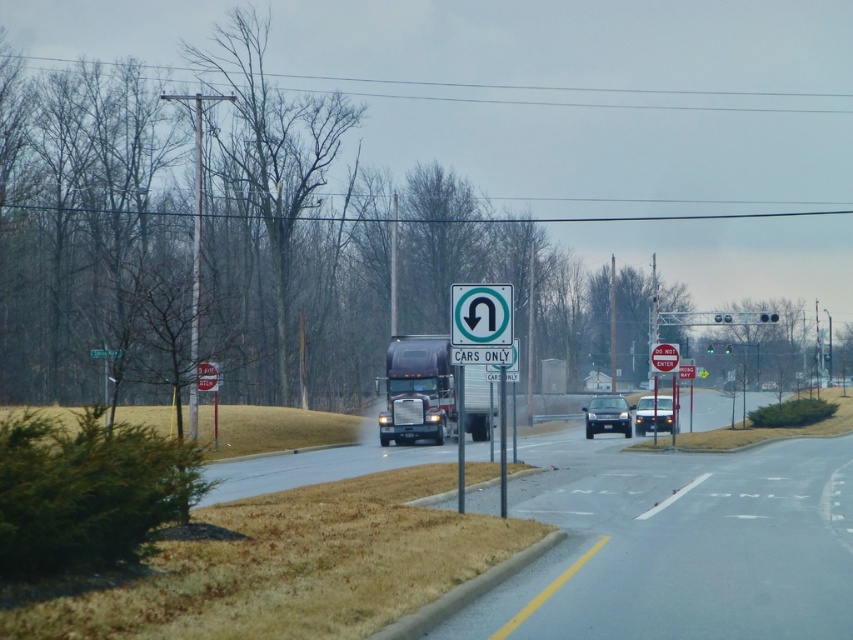
You are a pedestrian standing at the intersection and see two points marked on the road ahead. The first point is at coordinates point (662, 403) and the second is at point (650, 355). Which point is closer to you?

Point (662, 403) is further to the viewer than point (650, 355), so the point closer to you is point (650, 355).

You are a pedestrian standing at the intersection. You see a point marked at coordinates (607, 416). Which object is this point located on?

The point marked at coordinates (607, 416) is located on the matte black sedan at center.

You are driving a car that is 15 feet long and want to make a U turn in the U turn lane. The U turn lane has a red plastic sign at center and a matte black sedan at center. Can your car fit in the U turn lane for the U turn?

The distance between the matte black sedan at center and the red plastic sign at center is 36.32 feet. Since your car is 15 feet long, there is enough space to make the U turn as the available space is more than the car length.